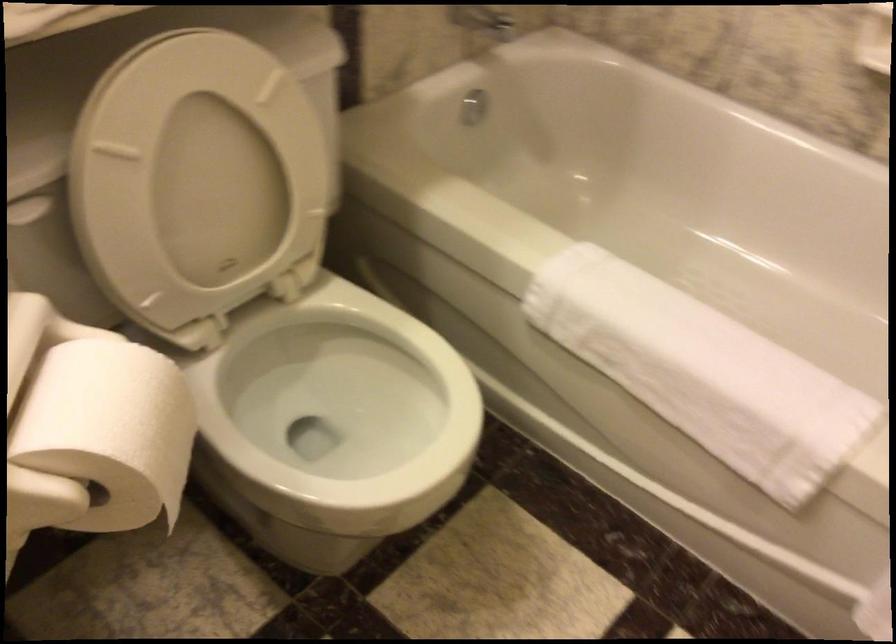
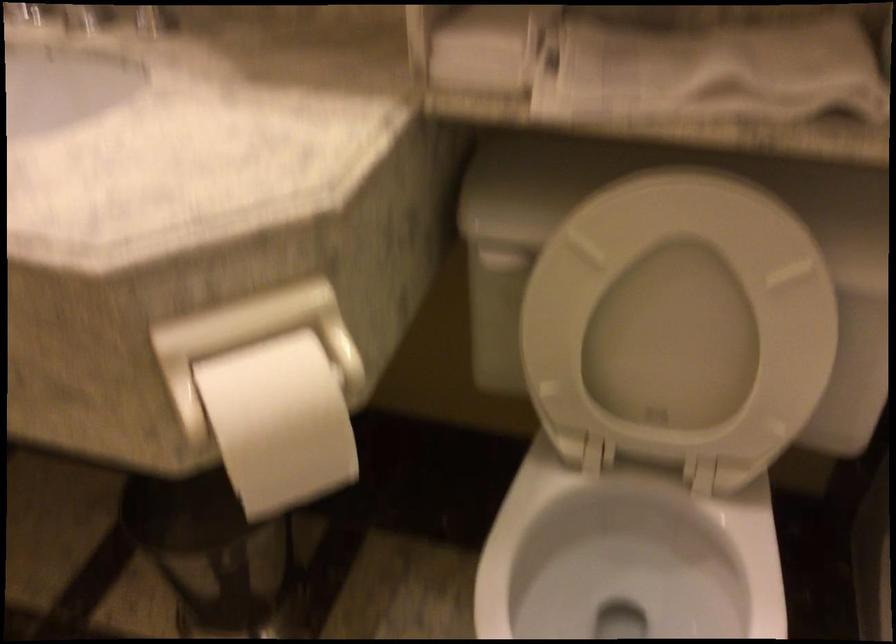
Locate, in the second image, the point that corresponds to [143,431] in the first image.

(279, 422)